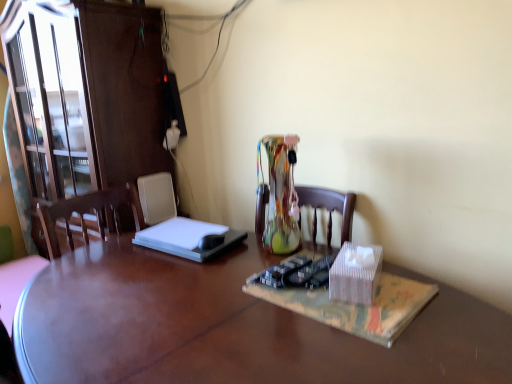
Find the location of a particular element. free space above translucent plastic book at center (from a real-world perspective) is located at coordinates (335, 294).